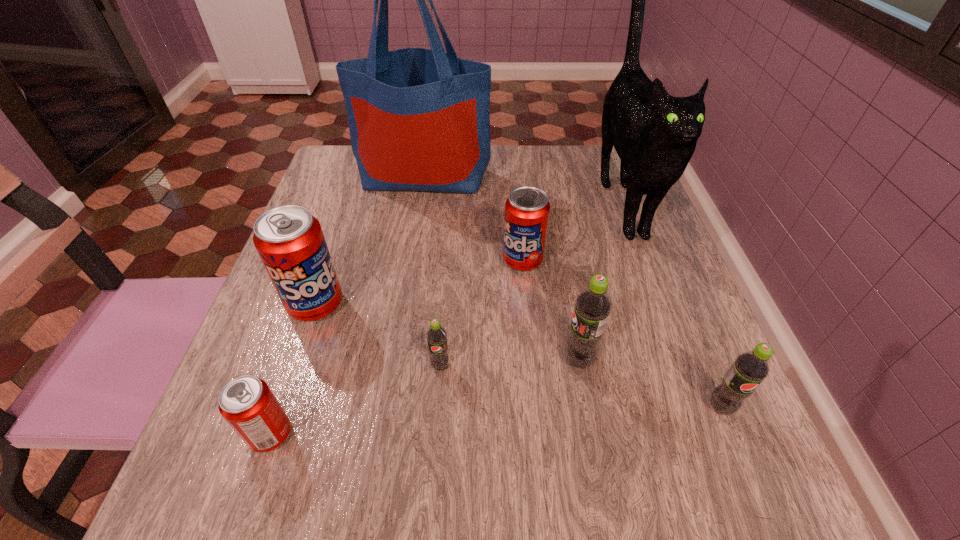
Identify the location of vacant space located 0.090m on the front label of the rightmost green soda. (752, 483).

Find the location of a particular element. The height and width of the screenshot is (540, 960). vacant space located on the front label of the third soda can from left to right is located at coordinates (431, 491).

The height and width of the screenshot is (540, 960). What are the coordinates of `free space located on the right of the nearest red soda can` in the screenshot? It's located at (463, 434).

Where is `handbag present at the far edge`? The width and height of the screenshot is (960, 540). handbag present at the far edge is located at coordinates (419, 119).

Locate an element on the screen. Image resolution: width=960 pixels, height=540 pixels. cat at the far edge is located at coordinates (654, 134).

The width and height of the screenshot is (960, 540). Find the location of `object that is positioned at the near edge`. object that is positioned at the near edge is located at coordinates (247, 403).

You are a GUI agent. You are given a task and a screenshot of the screen. Output one action in this format:
    pyautogui.click(x=<x>, y=<y>)
    Task: Click on the handbag that is at the left edge
    The width and height of the screenshot is (960, 540).
    Given the screenshot: What is the action you would take?
    pyautogui.click(x=419, y=119)

Identify the location of cat at the right edge. The image size is (960, 540). (654, 134).

This screenshot has height=540, width=960. Identify the location of soda that is at the right edge. (750, 368).

Where is `object at the far left corner`? The height and width of the screenshot is (540, 960). object at the far left corner is located at coordinates (419, 119).